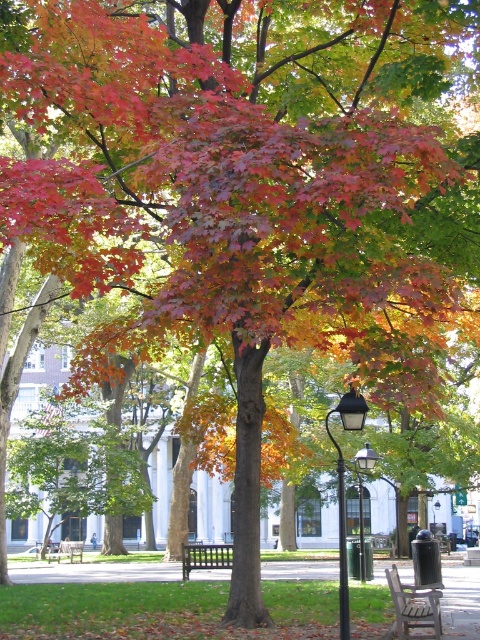
Question: Which object is farther from the camera taking this photo?

Choices:
 (A) wooden bench at center
 (B) black metal streetlight at lower right

Answer: (A)

Question: Which object appears closest to the camera in this image?

Choices:
 (A) wooden bench at lower right
 (B) wooden bench at center
 (C) black wooden bench at center
 (D) black metal streetlight at lower right

Answer: (D)

Question: In this image, where is black wooden bench at center located relative to wooden bench at center?

Choices:
 (A) below
 (B) above

Answer: (B)

Question: Which object is the farthest from the black wooden bench at center?

Choices:
 (A) wooden bench at center
 (B) black metal streetlight at lower right
 (C) wooden bench at lower right

Answer: (C)

Question: Can you confirm if wooden bench at lower right is thinner than wooden bench at center?

Choices:
 (A) yes
 (B) no

Answer: (A)

Question: Does black metal streetlight at lower right appear on the right side of wooden bench at lower right?

Choices:
 (A) no
 (B) yes

Answer: (B)